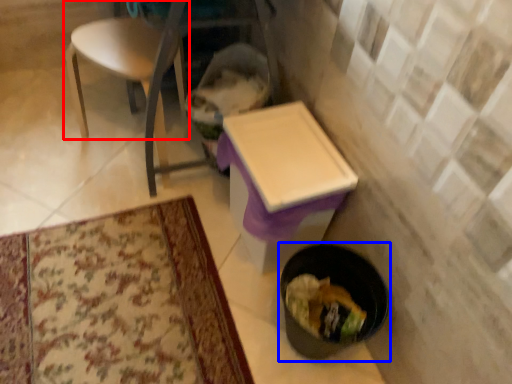
Question: Which of the following is the farthest to the observer, chair (highlighted by a red box) or potty (highlighted by a blue box)?

Choices:
 (A) chair
 (B) potty

Answer: (A)